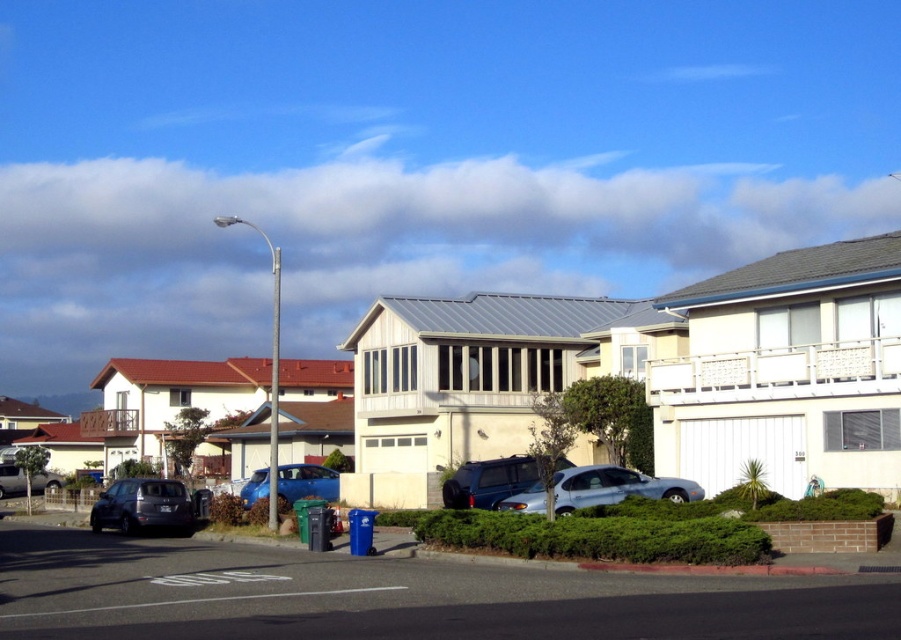
Based on the photo, you are a delivery driver who needs to park your vehicle in this area. Your truck is 2 meters tall. The matte gray suv at lower left and the satin blue suv at center are blocking the parking spots. Can you estimate if your truck can pass under the space between the two suvs?

The matte gray suv at lower left is much taller than the satin blue suv at center. Since the truck is 2 meters tall, it depends on the height of the lower suv. However, without specific measurements, it is uncertain whether the truck can pass safely.

You are a pedestrian standing at the crosswalk in the foreground. You need to cross the street and reach the house with the red tiled roof in the background. Which direction should you walk relative to the blue metallic car at center and the matte silver suv at lower left?

The blue metallic car at center is to the right of the matte silver suv at lower left. To reach the house with the red tiled roof in the background, you should walk towards the right side of the blue metallic car at center since it is positioned closer to the direction of the house with the red tiled roof.

Based on the photo, you are standing at the center of the crosswalk in the image. Which direction should you walk to reach the matte gray suv at lower left?

The matte gray suv at lower left is located at coordinates point (149, 506), so you should walk towards the lower left direction to reach it.